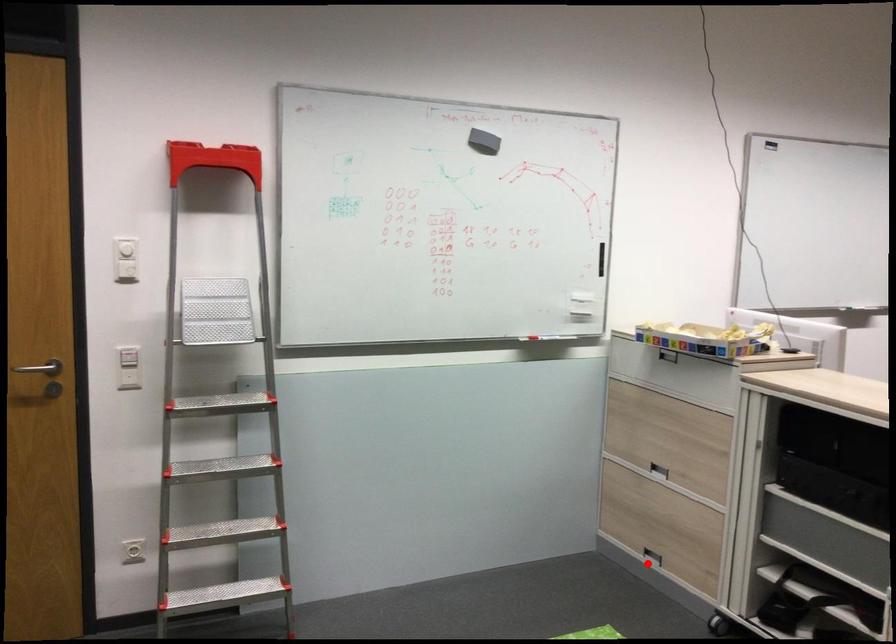
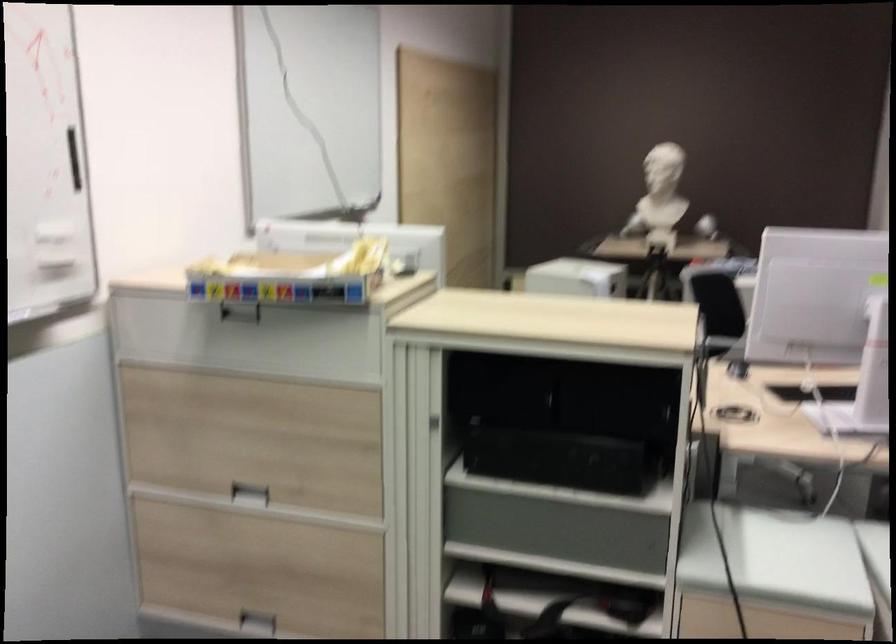
Question: I am providing you with two images of the same scene from different viewpoints. Given a red point in image1, look at the same physical point in image2. Is it:

Choices:
 (A) Closer to the viewpoint
 (B) Farther from the viewpoint

Answer: (A)